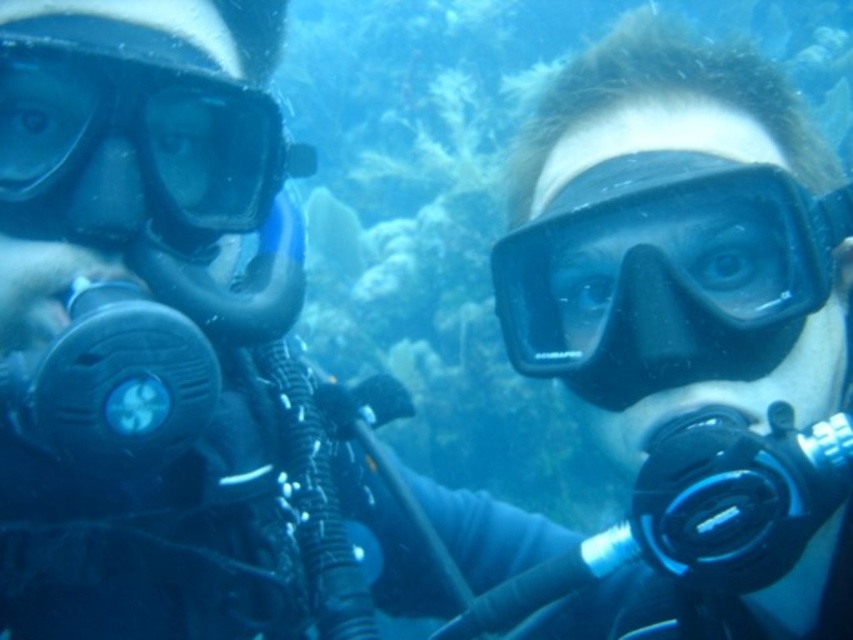
Question: Which point appears closest to the camera in this image?

Choices:
 (A) (26, 180)
 (B) (732, 161)

Answer: (A)

Question: Among these points, which one is farthest from the camera?

Choices:
 (A) (148, 106)
 (B) (720, 336)

Answer: (A)

Question: Among these objects, which one is farthest from the camera?

Choices:
 (A) transparent rubber goggles at left
 (B) black matte scuba mask at right

Answer: (B)

Question: Does black matte scuba mask at right appear on the left side of transparent rubber goggles at left?

Choices:
 (A) yes
 (B) no

Answer: (B)

Question: Is black matte scuba mask at right smaller than transparent rubber goggles at left?

Choices:
 (A) yes
 (B) no

Answer: (B)

Question: Observing the image, what is the correct spatial positioning of black matte scuba mask at right in reference to transparent rubber goggles at left?

Choices:
 (A) left
 (B) right

Answer: (B)